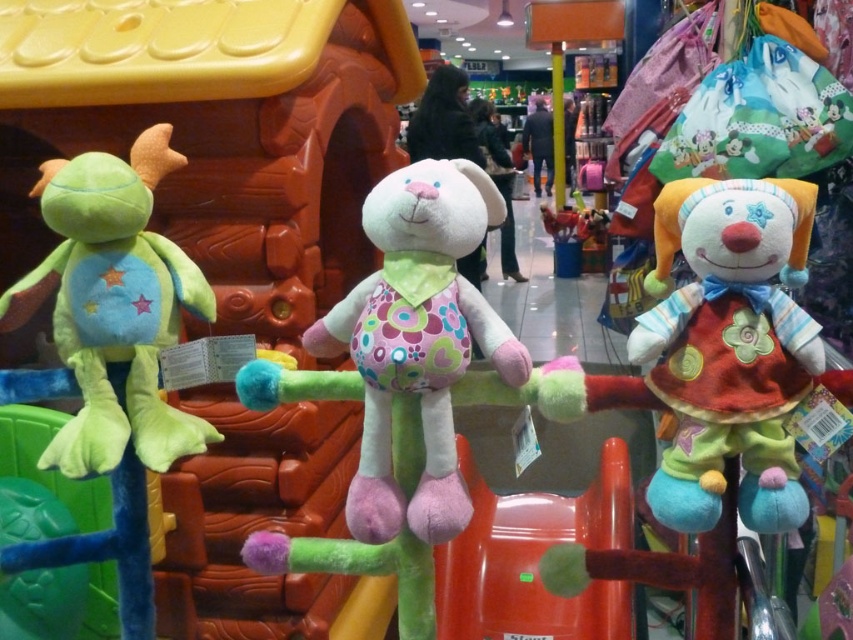
Is fluffy multicolored clown doll at right smaller than green plush turtle at left?

No, fluffy multicolored clown doll at right is not smaller than green plush turtle at left.

Does point (764, 264) come in front of point (120, 406)?

Yes.

Identify the location of fluffy multicolored clown doll at right. (729, 348).

Who is taller, fluffy multicolored clown doll at right or fluffy white plush rabbit at center?

With more height is fluffy white plush rabbit at center.

Is point (689, 477) positioned before point (392, 496)?

Yes, it is.

Is point (672, 256) behind point (454, 177)?

Yes.

Locate an element on the screen. Image resolution: width=853 pixels, height=640 pixels. fluffy multicolored clown doll at right is located at coordinates (729, 348).

From the picture: Between fluffy white plush rabbit at center and green plush turtle at left, which one appears on the left side from the viewer's perspective?

From the viewer's perspective, green plush turtle at left appears more on the left side.

Who is higher up, fluffy white plush rabbit at center or green plush turtle at left?

green plush turtle at left

Between point (358, 298) and point (56, 272), which one is positioned in front?

Point (358, 298) is more forward.

This screenshot has height=640, width=853. Find the location of `fluffy white plush rabbit at center`. fluffy white plush rabbit at center is located at coordinates (418, 340).